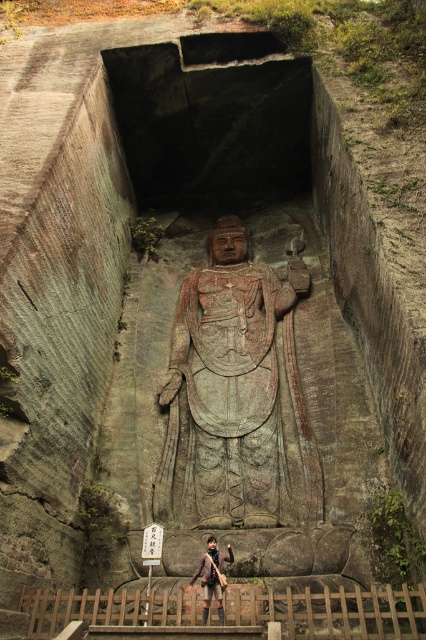
You are a hiker who has just arrived at the cliff face. You notice the gray stone statue at center and the brown leather jacket at lower center. Which object is higher up on the cliff?

The gray stone statue at center is positioned over the brown leather jacket at lower center, so the gray stone statue at center is higher up on the cliff.

You are a photographer trying to capture the gray stone statue at center and the brown leather jacket at lower center in the same frame. Based on their positions, which object should you adjust your camera to focus on first to ensure both are in the shot?

The gray stone statue at center is to the right of the brown leather jacket at lower center, so you should focus on the brown leather jacket at lower center first to ensure both are included in the frame.